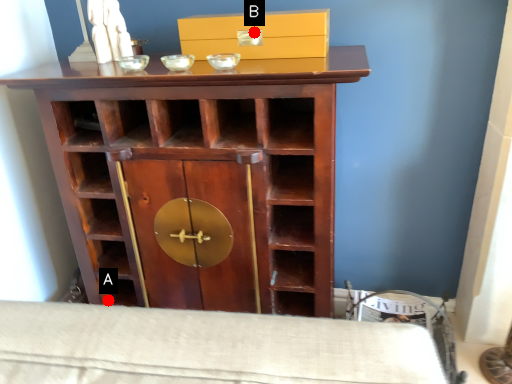
Question: Two points are circled on the image, labeled by A and B beside each circle. Which of the following is the closest to the observer?

Choices:
 (A) A is closer
 (B) B is closer

Answer: (B)